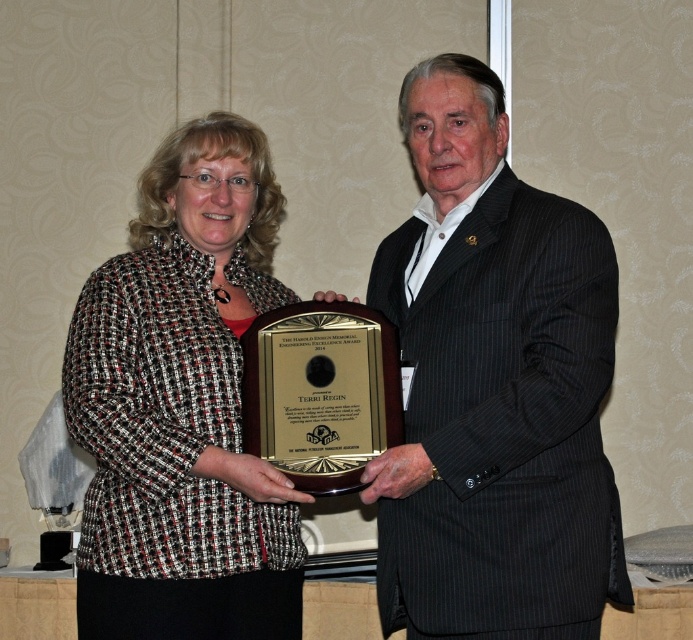
You are a photographer setting up for a group photo. You notice two jackets in the scene, the black pinstripe suit at center and the tweed jacket at center. Which jacket should you adjust to ensure they are at the same height in the frame?

The black pinstripe suit at center is taller than the tweed jacket at center. To make them the same height in the frame, adjust the black pinstripe suit at center by lowering it or raising the tweed jacket at center.